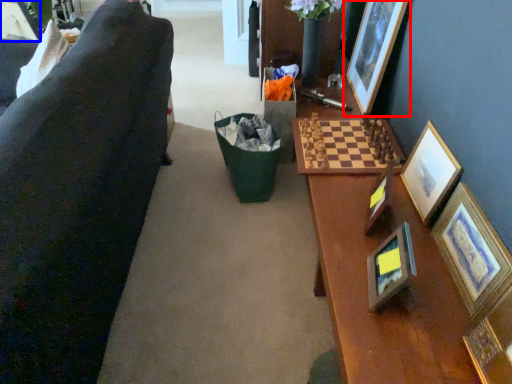
Question: Which object is further to the camera taking this photo, picture frame (highlighted by a red box) or picture frame (highlighted by a blue box)?

Choices:
 (A) picture frame
 (B) picture frame

Answer: (B)